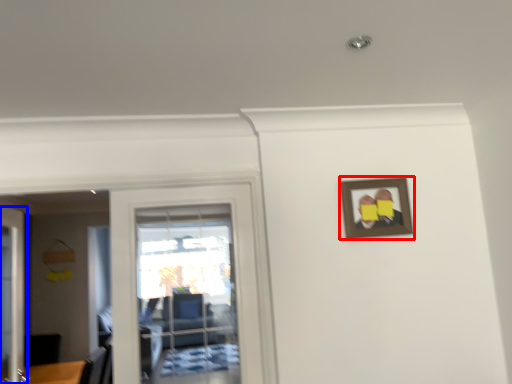
Question: Which object is further to the camera taking this photo, picture frame (highlighted by a red box) or door (highlighted by a blue box)?

Choices:
 (A) picture frame
 (B) door

Answer: (A)